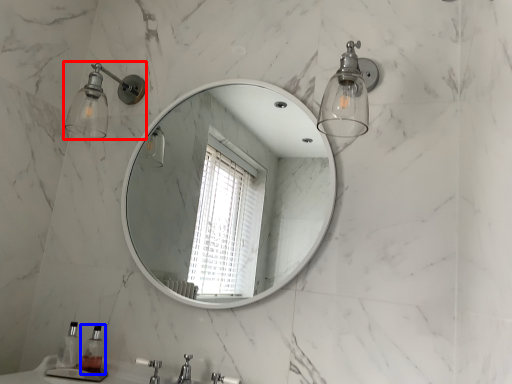
Question: Which object is closer to the camera taking this photo, shower (highlighted by a red box) or soap dispenser (highlighted by a blue box)?

Choices:
 (A) shower
 (B) soap dispenser

Answer: (B)